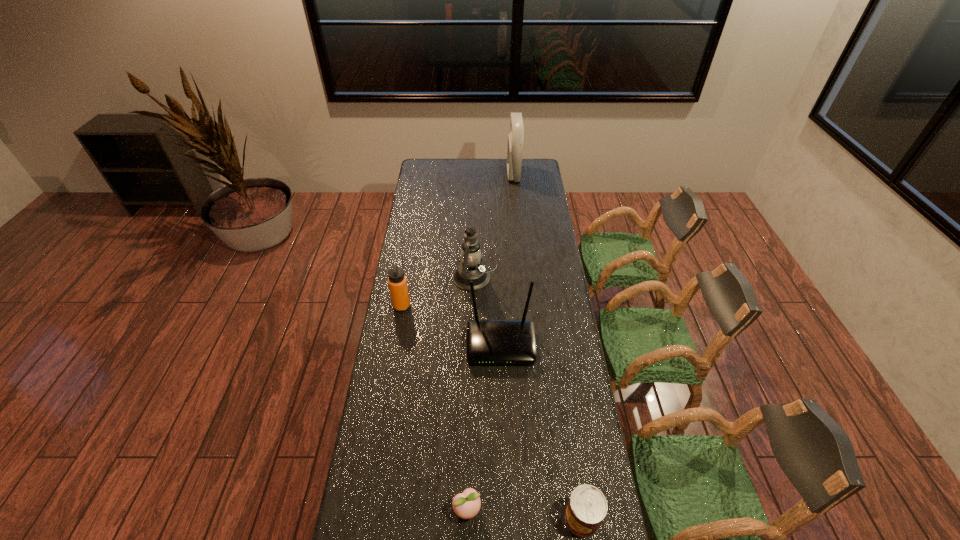
Where is `object that is positioned at the far right corner`? Image resolution: width=960 pixels, height=540 pixels. object that is positioned at the far right corner is located at coordinates (515, 139).

This screenshot has width=960, height=540. In the image, there is a desktop. In order to click on free space at the far edge in this screenshot , I will do `click(447, 178)`.

Where is `free space at the left edge of the desktop`? The height and width of the screenshot is (540, 960). free space at the left edge of the desktop is located at coordinates (411, 376).

Where is `vacant space at the right edge`? This screenshot has width=960, height=540. vacant space at the right edge is located at coordinates (554, 265).

At what (x,y) coordinates should I click in order to perform the action: click on free space between the third nearest object and the shortest object. Please return your answer as a coordinate pair (x, y). This screenshot has height=540, width=960. Looking at the image, I should click on (484, 427).

At what (x,y) coordinates should I click in order to perform the action: click on empty location between the third farthest object and the can. Please return your answer as a coordinate pair (x, y). The width and height of the screenshot is (960, 540). Looking at the image, I should click on (492, 413).

Find the location of a particular element. This screenshot has height=540, width=960. vacant area between the oil lamp and the fourth nearest object is located at coordinates (438, 292).

Identify the location of vacant space in between the farthest object and the oil lamp. This screenshot has height=540, width=960. (493, 226).

Where is `vacant space in between the fourth nearest object and the first-aid kit`? vacant space in between the fourth nearest object and the first-aid kit is located at coordinates (458, 240).

I want to click on free spot between the fourth farthest object and the can, so click(x=541, y=431).